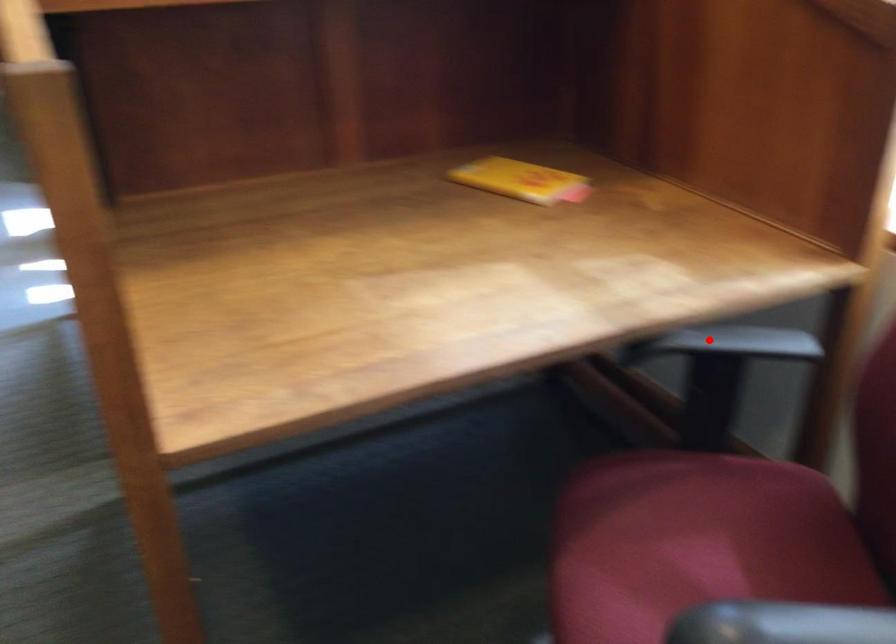
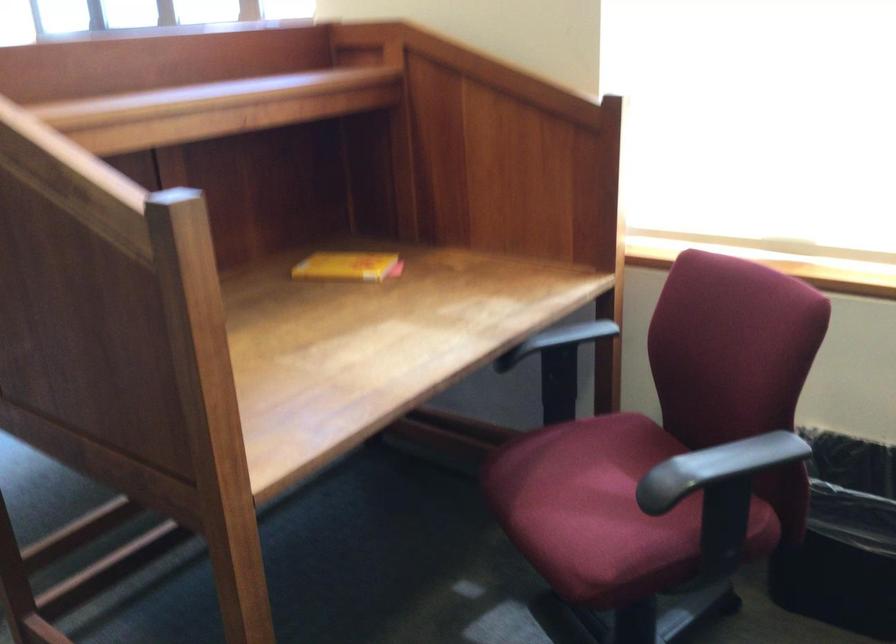
Find the pixel in the second image that matches the highlighted location in the first image.

(556, 339)